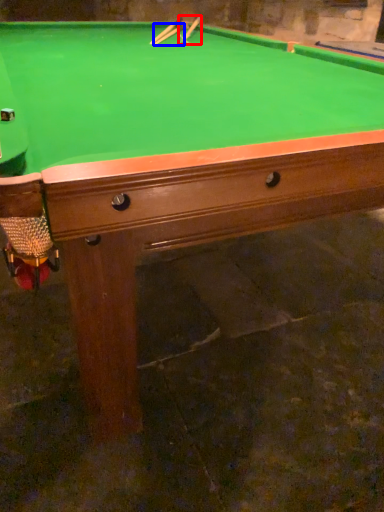
Question: Which of the following is the closest to the observer, cue (highlighted by a red box) or cue (highlighted by a blue box)?

Choices:
 (A) cue
 (B) cue

Answer: (B)